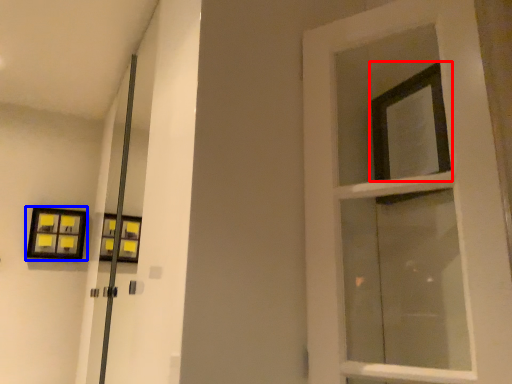
Question: Which point is further to the camera, window (highlighted by a red box) or picture frame (highlighted by a blue box)?

Choices:
 (A) window
 (B) picture frame

Answer: (B)